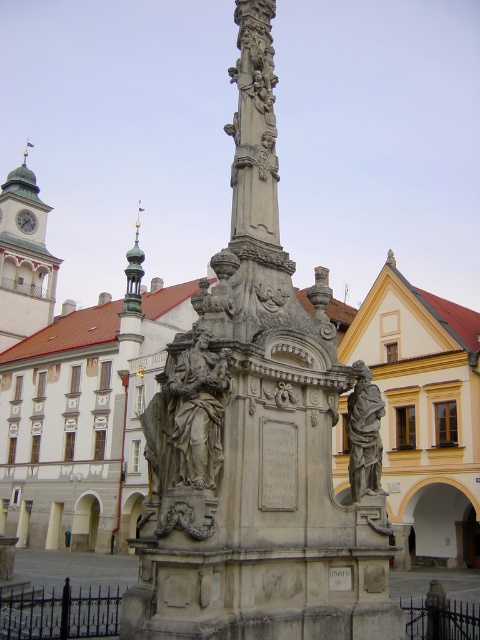
You are standing in the town square and want to take a photo that includes both the green stone clock tower at upper left and the stone plaque at center. Given that your camera has a maximum zoom range of 100 meters, will you be able to capture both in the same frame without moving your position?

The green stone clock tower at upper left and the stone plaque at center are 145.33 meters apart. Since the camera can only zoom up to 100 meters, the distance between them exceeds the camera range. You won

You are standing in the town square looking at the historical stone monument. There is a point at coordinates point (24, 260). Can you tell me which object this point belongs to?

The point (24, 260) is on the green stone clock tower at upper left.